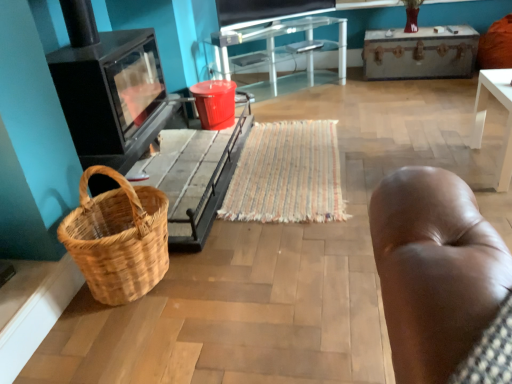
Question: Is transparent glass table at center to the left of black glass stove at left from the viewer's perspective?

Choices:
 (A) no
 (B) yes

Answer: (A)

Question: Is transparent glass table at center touching black glass stove at left?

Choices:
 (A) yes
 (B) no

Answer: (B)

Question: Is transparent glass table at center taller than black glass stove at left?

Choices:
 (A) yes
 (B) no

Answer: (B)

Question: Would you say transparent glass table at center is outside black glass stove at left?

Choices:
 (A) yes
 (B) no

Answer: (A)

Question: Does transparent glass table at center have a larger size compared to black glass stove at left?

Choices:
 (A) yes
 (B) no

Answer: (B)

Question: From the image's perspective, is matte black television at upper center located above or below transparent glass table at center?

Choices:
 (A) below
 (B) above

Answer: (B)

Question: From a real-world perspective, is matte black television at upper center physically located above or below transparent glass table at center?

Choices:
 (A) below
 (B) above

Answer: (B)

Question: Do you think matte black television at upper center is within transparent glass table at center, or outside of it?

Choices:
 (A) outside
 (B) inside

Answer: (A)

Question: Considering the positions of matte black television at upper center and transparent glass table at center in the image, is matte black television at upper center taller or shorter than transparent glass table at center?

Choices:
 (A) short
 (B) tall

Answer: (A)

Question: From the image's perspective, is wooden trunk at upper right, acting as the second table starting from the bottom, positioned above or below woven wood basket at lower left, marked as the 1th table in a front-to-back arrangement?

Choices:
 (A) below
 (B) above

Answer: (B)

Question: Is wooden trunk at upper right, the second table viewed from the left, taller or shorter than woven wood basket at lower left, marked as the 1th table in a front-to-back arrangement?

Choices:
 (A) short
 (B) tall

Answer: (B)

Question: Is wooden trunk at upper right, the 2th table positioned from the front, situated inside woven wood basket at lower left, which is counted as the 1th table, starting from the left, or outside?

Choices:
 (A) inside
 (B) outside

Answer: (B)

Question: Considering the positions of wooden trunk at upper right, acting as the second table starting from the bottom, and woven wood basket at lower left, the second table from the top, in the image, is wooden trunk at upper right, acting as the second table starting from the bottom, bigger or smaller than woven wood basket at lower left, the second table from the top,?

Choices:
 (A) big
 (B) small

Answer: (B)

Question: Is matte black television at upper center taller or shorter than brown woven picnic basket at lower left?

Choices:
 (A) tall
 (B) short

Answer: (B)

Question: From the image's perspective, is matte black television at upper center positioned above or below brown woven picnic basket at lower left?

Choices:
 (A) below
 (B) above

Answer: (B)